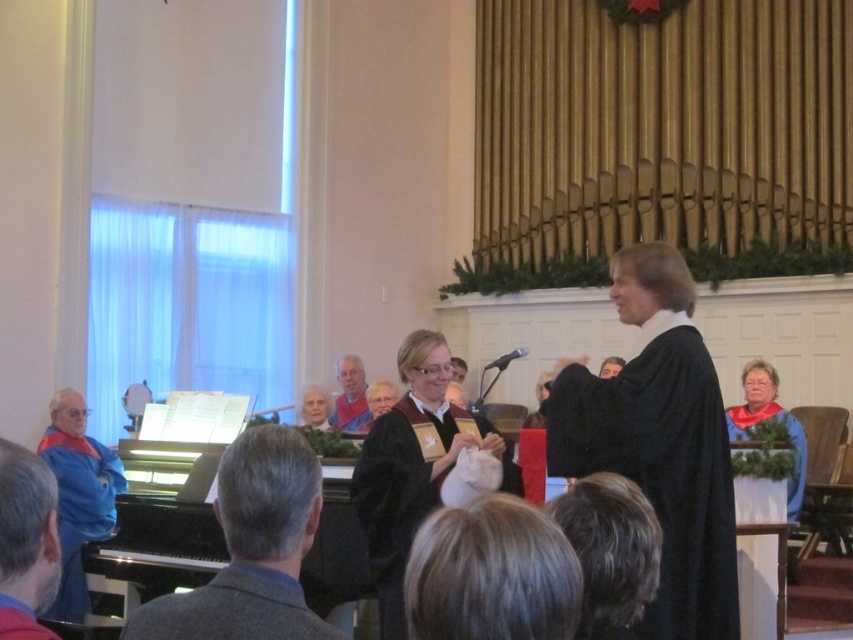
You are a photographer at this event and need to capture a closeup of the matte black robe at center and the blue fleece robe at left. Given their sizes, which robe will appear larger in the photo?

The blue fleece robe at left will appear larger in the photo because it is bigger in size than the matte black robe at center.

In the scene shown: You are a photographer positioned at the back of the church. You want to take a photo of the two robes at center without the blue velvet robe at center being obscured by the matte black robe at center. Which robe should you focus on first to ensure it appears in front?

The matte black robe at center is further to the viewer than blue velvet robe at center, so focusing on the matte black robe at center first will ensure it appears in front in the photo.